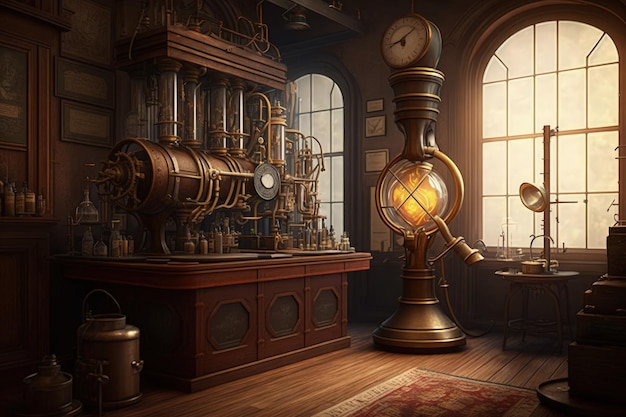
You are a GUI agent. You are given a task and a screenshot of the screen. Output one action in this format:
    pyautogui.click(x=<x>, y=<y>)
    Task: Click on the rug
    Image resolution: width=626 pixels, height=417 pixels.
    Given the screenshot: What is the action you would take?
    pyautogui.click(x=424, y=406)